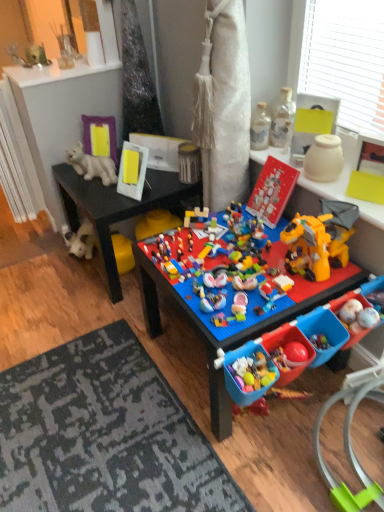
Where is `vacant region in front of clear glass bottle at upper right, the fifth toy when ordered from left to right`? This screenshot has height=512, width=384. vacant region in front of clear glass bottle at upper right, the fifth toy when ordered from left to right is located at coordinates (277, 157).